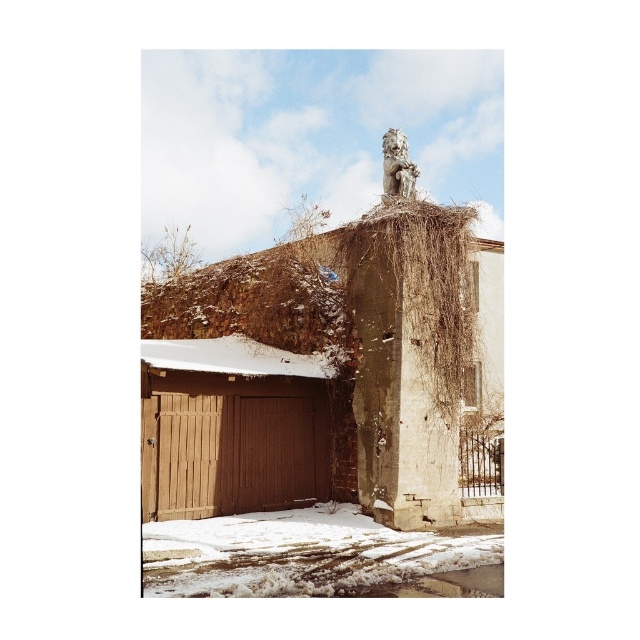
Question: From the image, what is the correct spatial relationship of brown wooden hut at center in relation to brown wood/glass garage at lower left?

Choices:
 (A) below
 (B) above

Answer: (B)

Question: Estimate the real-world distances between objects in this image. Which object is closer to the brown wooden hut at center?

Choices:
 (A) brown wood/glass garage at lower left
 (B) stone statue at upper center
 (C) white matte roof at center

Answer: (C)

Question: Among these objects, which one is nearest to the camera?

Choices:
 (A) brown wooden hut at center
 (B) brown wood/glass garage at lower left
 (C) stone statue at upper center

Answer: (A)

Question: Where is brown wood/glass garage at lower left located in relation to stone statue at upper center in the image?

Choices:
 (A) above
 (B) below

Answer: (B)

Question: Does brown wooden hut at center appear under white matte roof at center?

Choices:
 (A) no
 (B) yes

Answer: (B)

Question: Which object is farther from the camera taking this photo?

Choices:
 (A) brown wooden hut at center
 (B) white matte roof at center

Answer: (B)